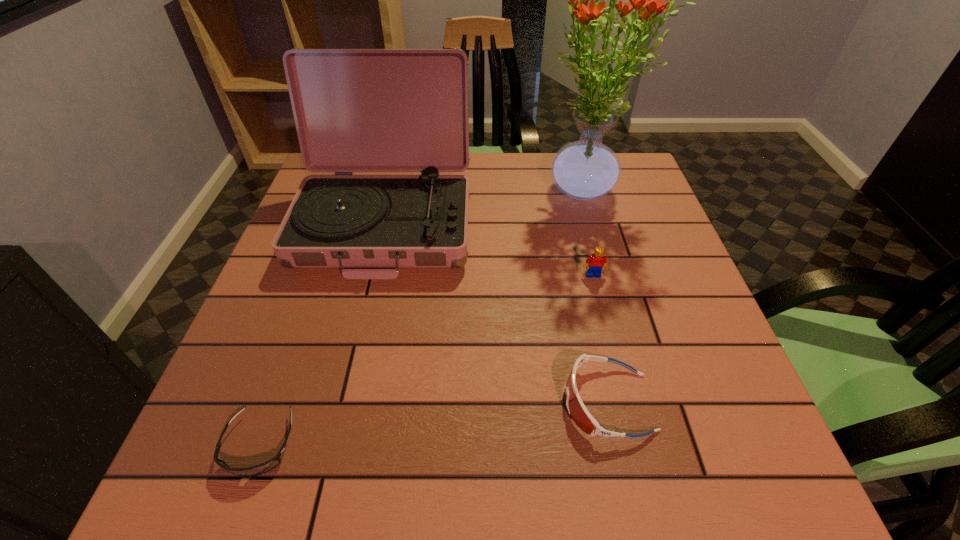
I want to click on free space in the image that satisfies the following two spatial constraints: 1. on the front-facing side of the fourth tallest object; 2. on the lenses of the shorter goggles, so click(616, 444).

This screenshot has height=540, width=960. What are the coordinates of `vacant position in the image that satisfies the following two spatial constraints: 1. on the front-facing side of the right goggles; 2. on the lenses of the shorter goggles` in the screenshot? It's located at (616, 444).

You are a GUI agent. You are given a task and a screenshot of the screen. Output one action in this format:
    pyautogui.click(x=<x>, y=<y>)
    Task: Click on the vacant space that satisfies the following two spatial constraints: 1. on the front-facing side of the right goggles; 2. on the lenses of the left goggles
    The height and width of the screenshot is (540, 960).
    Given the screenshot: What is the action you would take?
    pyautogui.click(x=616, y=444)

The image size is (960, 540). I want to click on vacant space that satisfies the following two spatial constraints: 1. on the front-facing side of the fourth tallest object; 2. on the lenses of the shorter goggles, so click(x=616, y=444).

At what (x,y) coordinates should I click in order to perform the action: click on free space in the image that satisfies the following two spatial constraints: 1. on the front-facing side of the Lego; 2. on the front-facing side of the second shortest object. Please return your answer as a coordinate pair (x, y). Looking at the image, I should click on (625, 402).